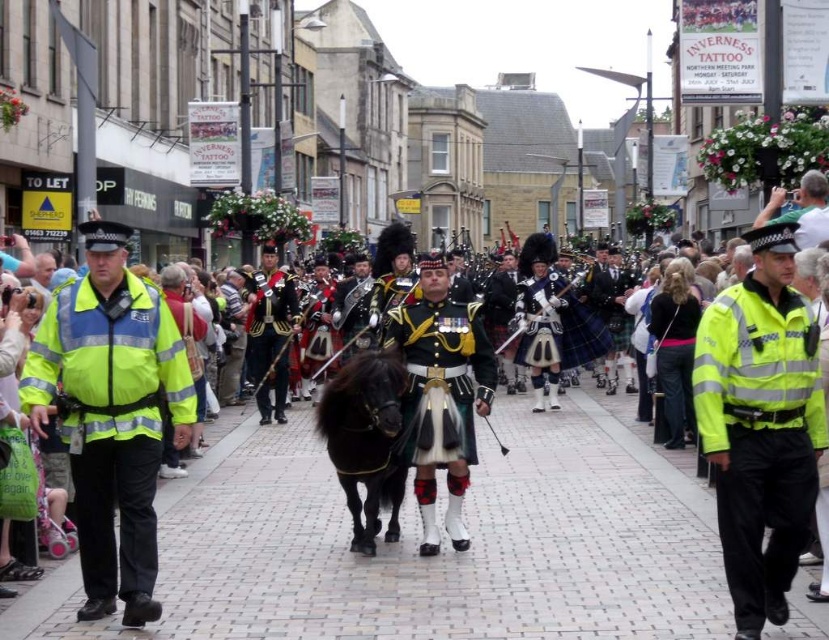
You are a pedestrian standing on the brick pavement at center. You want to walk towards the shiny gold uniform at center. Which direction should you move?

The brick pavement at center is to the left of shiny gold uniform at center, so you should move to the right to reach the shiny gold uniform at center.

You are a pedestrian standing on the street during the parade. There is a high visibility yellow jacket at left and a shiny black uniform at center. Can you safely walk between them without getting too close? The minimum safe distance required is 5 feet.

The high visibility yellow jacket at left and shiny black uniform at center are 82.01 feet apart, so yes, you can safely walk between them without getting too close as the distance is well above the 5 feet minimum requirement.

You are a photographer trying to capture a clear shot of the high visibility yellow jacket at left and the shiny black uniform at center. Since you want both subjects in focus, you need to know their relative sizes. Which object is wider?

The high visibility yellow jacket at left is wider than the shiny black uniform at center.